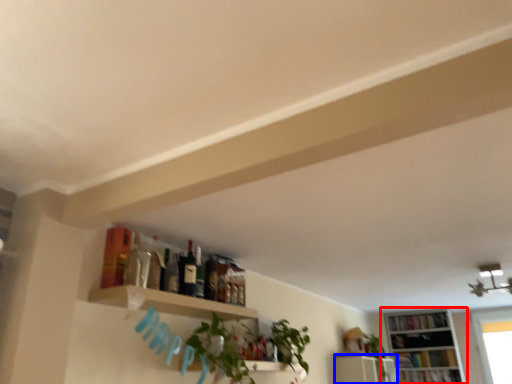
Question: Which object is further to the camera taking this photo, bookcase (highlighted by a red box) or shelf (highlighted by a blue box)?

Choices:
 (A) bookcase
 (B) shelf

Answer: (A)